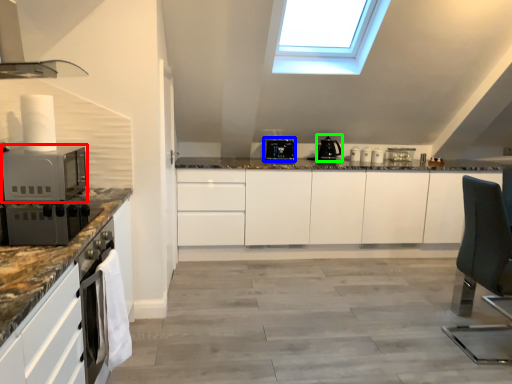
Question: Based on their relative distances, which object is nearer to microwave oven (highlighted by a red box)? Choose from kitchen appliance (highlighted by a blue box) and kitchen appliance (highlighted by a green box).

Choices:
 (A) kitchen appliance
 (B) kitchen appliance

Answer: (A)